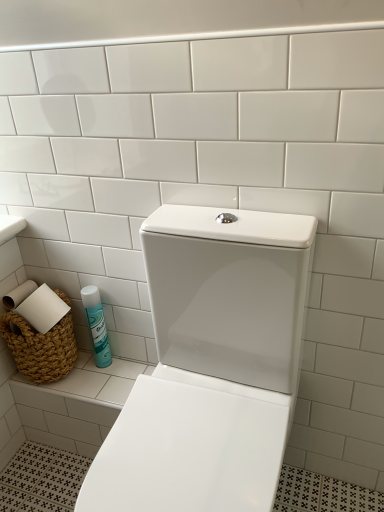
Question: Is braided wicker basket at lower left at the left side of blue glossy can at lower left?

Choices:
 (A) no
 (B) yes

Answer: (B)

Question: Is braided wicker basket at lower left at the right side of blue glossy can at lower left?

Choices:
 (A) yes
 (B) no

Answer: (B)

Question: Can you confirm if braided wicker basket at lower left is thinner than blue glossy can at lower left?

Choices:
 (A) no
 (B) yes

Answer: (A)

Question: Considering the relative sizes of braided wicker basket at lower left and blue glossy can at lower left in the image provided, is braided wicker basket at lower left bigger than blue glossy can at lower left?

Choices:
 (A) no
 (B) yes

Answer: (B)

Question: Considering the relative sizes of braided wicker basket at lower left and blue glossy can at lower left in the image provided, is braided wicker basket at lower left shorter than blue glossy can at lower left?

Choices:
 (A) yes
 (B) no

Answer: (B)

Question: From the image's perspective, is braided wicker basket at lower left below blue glossy can at lower left?

Choices:
 (A) yes
 (B) no

Answer: (B)

Question: Is blue glossy can at lower left taller than braided wicker basket at lower left?

Choices:
 (A) no
 (B) yes

Answer: (A)

Question: Does blue glossy can at lower left have a greater width compared to braided wicker basket at lower left?

Choices:
 (A) no
 (B) yes

Answer: (A)

Question: Is blue glossy can at lower left further to camera compared to braided wicker basket at lower left?

Choices:
 (A) yes
 (B) no

Answer: (A)

Question: From a real-world perspective, is blue glossy can at lower left over braided wicker basket at lower left?

Choices:
 (A) no
 (B) yes

Answer: (A)

Question: Is blue glossy can at lower left positioned with its back to braided wicker basket at lower left?

Choices:
 (A) yes
 (B) no

Answer: (B)

Question: Considering the relative sizes of blue glossy can at lower left and braided wicker basket at lower left in the image provided, is blue glossy can at lower left thinner than braided wicker basket at lower left?

Choices:
 (A) yes
 (B) no

Answer: (A)

Question: Is white glossy toilet at center oriented towards blue glossy can at lower left?

Choices:
 (A) no
 (B) yes

Answer: (A)